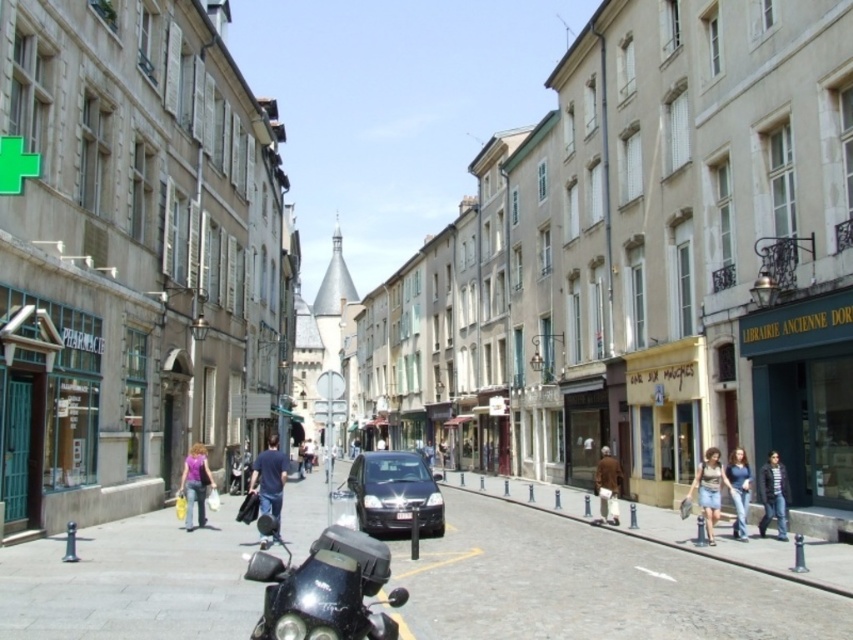
Can you confirm if shiny black motorcycle at lower left is positioned to the right of matte pink shirt at center?

Yes, shiny black motorcycle at lower left is to the right of matte pink shirt at center.

Does shiny black motorcycle at lower left have a lesser width compared to matte pink shirt at center?

Yes.

Find the location of a particular element. Image resolution: width=853 pixels, height=640 pixels. shiny black motorcycle at lower left is located at coordinates (326, 589).

Is dark blue shirt at center shorter than denim shorts at lower right?

Incorrect, dark blue shirt at center's height does not fall short of denim shorts at lower right's.

Between dark blue shirt at center and denim shorts at lower right, which one has less height?

denim shorts at lower right

Who is more distant from viewer, (267, 449) or (714, 500)?

Positioned behind is point (267, 449).

Locate an element on the screen. dark blue shirt at center is located at coordinates (270, 481).

Is point (61, 570) less distant than point (440, 449)?

Yes, point (61, 570) is closer to viewer.

Is point (730, 602) positioned behind point (444, 440)?

No, it is not.

The width and height of the screenshot is (853, 640). I want to click on smooth cobblestone street at center, so click(x=589, y=584).